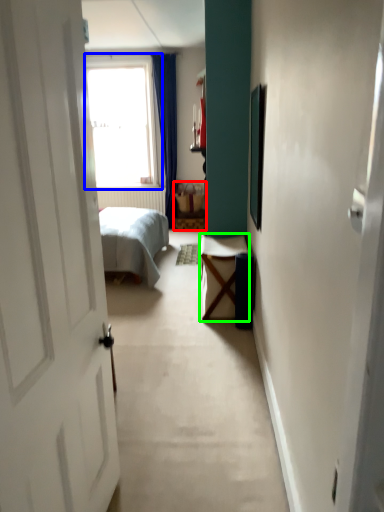
Question: Which object is the closest to the furniture (highlighted by a red box)? Choose among these: window (highlighted by a blue box) or table (highlighted by a green box).

Choices:
 (A) window
 (B) table

Answer: (A)